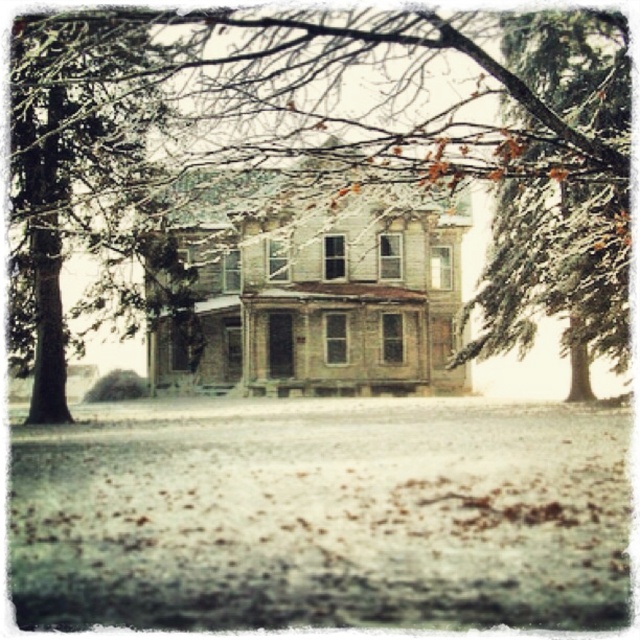
Question: Can you confirm if white fluffy snow at lower center is positioned to the left of snow-covered pine tree at center?

Choices:
 (A) yes
 (B) no

Answer: (A)

Question: Among these objects, which one is farthest from the camera?

Choices:
 (A) green textured pine tree at upper right
 (B) white fluffy snow at lower center

Answer: (A)

Question: Which object is positioned closest to the snow-covered pine tree at center?

Choices:
 (A) green textured pine tree at upper right
 (B) white fluffy snow at lower center

Answer: (A)

Question: Is white fluffy snow at lower center above snow-covered pine tree at center?

Choices:
 (A) yes
 (B) no

Answer: (B)

Question: Which point appears farthest from the camera in this image?

Choices:
 (A) (593, 531)
 (B) (621, 97)

Answer: (B)

Question: Does white fluffy snow at lower center have a larger size compared to green textured pine tree at upper right?

Choices:
 (A) no
 (B) yes

Answer: (A)